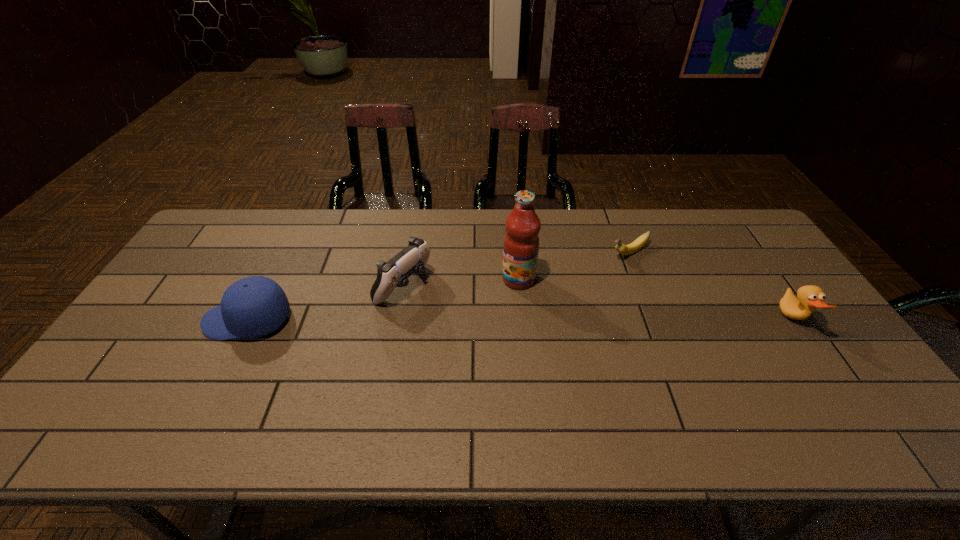
In order to click on object present at the right edge in this screenshot , I will do [810, 297].

You are a GUI agent. You are given a task and a screenshot of the screen. Output one action in this format:
    pyautogui.click(x=<x>, y=<y>)
    Task: Click on the vacant space at the far edge of the desktop
    
    Given the screenshot: What is the action you would take?
    pyautogui.click(x=268, y=214)

Identify the location of free space at the near edge. This screenshot has height=540, width=960. (290, 380).

Where is `vacant region at the left edge of the desktop`? vacant region at the left edge of the desktop is located at coordinates (181, 274).

Image resolution: width=960 pixels, height=540 pixels. In the image, there is a desktop. In order to click on vacant space at the right edge in this screenshot , I will do `click(804, 346)`.

Image resolution: width=960 pixels, height=540 pixels. I want to click on vacant region at the far left corner of the desktop, so click(242, 240).

This screenshot has width=960, height=540. In order to click on vacant space at the near left corner in this screenshot , I will do `click(155, 388)`.

The height and width of the screenshot is (540, 960). In the image, there is a desktop. What are the coordinates of `free space at the far right corner` in the screenshot? It's located at (709, 221).

Find the location of a particular element. This screenshot has height=540, width=960. vacant point located between the cap and the banana is located at coordinates (438, 287).

In order to click on free space between the rightmost object and the fourth object from right to left in this screenshot , I will do tap(598, 303).